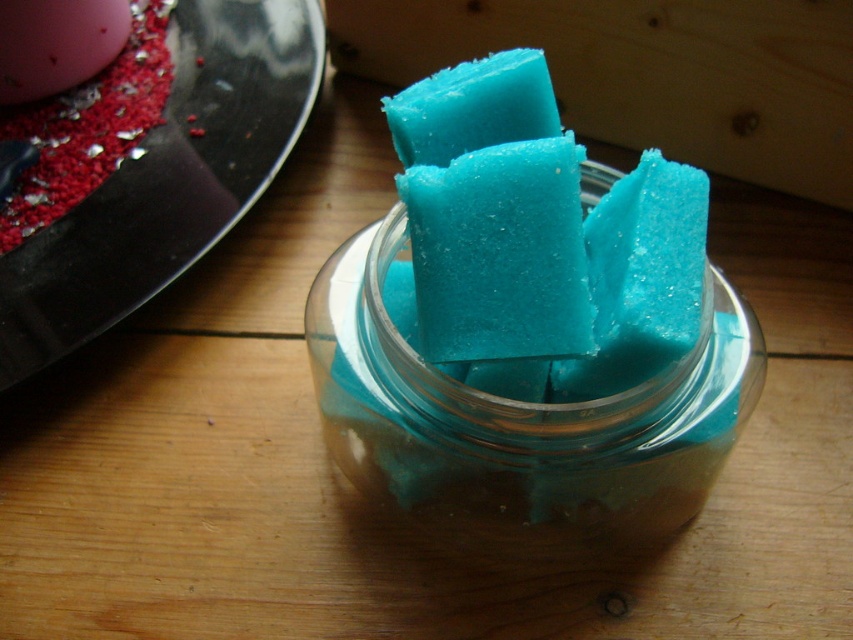
Question: Which object is positioned closest to the transparent glass jar at center?

Choices:
 (A) blue translucent soap at center
 (B) teal matte soap at center

Answer: (A)

Question: Among these points, which one is farthest from the camera?

Choices:
 (A) (393, 179)
 (B) (369, 497)
 (C) (537, 60)

Answer: (B)

Question: Is transparent glass jar at center further to the viewer compared to blue translucent soap at center?

Choices:
 (A) no
 (B) yes

Answer: (B)

Question: Can you confirm if blue translucent soap at center is positioned to the right of teal matte soap at center?

Choices:
 (A) yes
 (B) no

Answer: (A)

Question: Which point appears closest to the camera in this image?

Choices:
 (A) [x=531, y=96]
 (B) [x=512, y=433]

Answer: (B)

Question: Considering the relative positions of transparent glass jar at center and blue translucent soap at center in the image provided, where is transparent glass jar at center located with respect to blue translucent soap at center?

Choices:
 (A) right
 (B) left

Answer: (A)